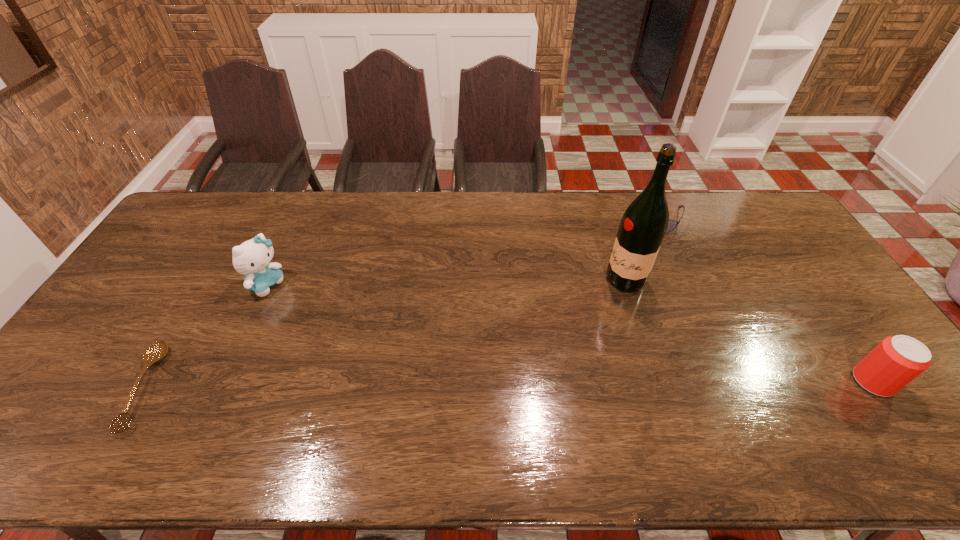
Identify the location of free location located 0.190m on the left of the shortest object. (53, 387).

In order to click on free region located on the back of the third tallest object in this screenshot , I will do `click(789, 262)`.

Image resolution: width=960 pixels, height=540 pixels. In order to click on free space located on the front-facing side of the tallest object in this screenshot , I will do `click(588, 306)`.

Where is `free region located 0.310m on the front-facing side of the tallest object`? The height and width of the screenshot is (540, 960). free region located 0.310m on the front-facing side of the tallest object is located at coordinates (537, 339).

Where is `free spot located on the front-facing side of the tallest object`? Image resolution: width=960 pixels, height=540 pixels. free spot located on the front-facing side of the tallest object is located at coordinates (599, 298).

Identify the location of vacant space located 0.360m on the face of the second object from left to right. The image size is (960, 540). (370, 345).

The height and width of the screenshot is (540, 960). I want to click on blank space located on the face of the second object from left to right, so click(x=374, y=348).

Image resolution: width=960 pixels, height=540 pixels. What are the coordinates of `vacant space situated 0.290m on the face of the second object from left to right` in the screenshot? It's located at (350, 334).

I want to click on free location located 0.160m on the lenses of the farthest object, so click(x=634, y=258).

The height and width of the screenshot is (540, 960). What are the coordinates of `blank space located 0.310m on the lenses of the farthest object` in the screenshot? It's located at [x=617, y=287].